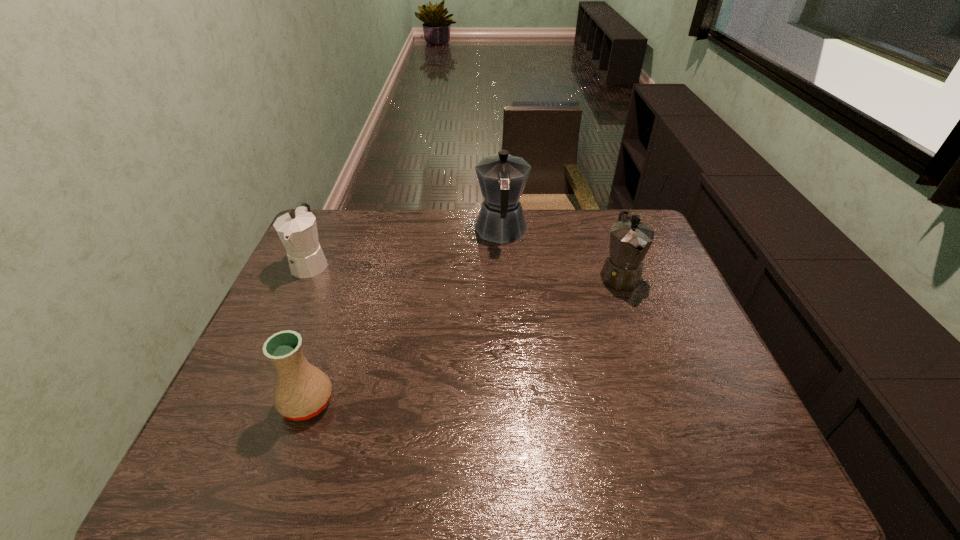
Where is `the third object from left to right`? Image resolution: width=960 pixels, height=540 pixels. the third object from left to right is located at coordinates (x=502, y=177).

Identify the location of the second coffeepot from right to left. (502, 177).

The height and width of the screenshot is (540, 960). I want to click on the rightmost coffeepot, so click(630, 239).

Image resolution: width=960 pixels, height=540 pixels. What are the coordinates of `the leftmost coffeepot` in the screenshot? It's located at (297, 229).

Identify the location of the nearest object. (302, 391).

Where is `pottery`? The height and width of the screenshot is (540, 960). pottery is located at coordinates (302, 391).

The image size is (960, 540). What are the coordinates of `free space located on the pouring side of the rightmost object` in the screenshot? It's located at (668, 411).

Identify the location of vacant space situated at the spout of the leftmost object. The image size is (960, 540). (268, 358).

Locate an element on the screen. This screenshot has width=960, height=540. vacant space situated 0.280m on the back of the second object from left to right is located at coordinates (343, 299).

This screenshot has width=960, height=540. I want to click on coffeepot present at the left edge, so click(x=297, y=229).